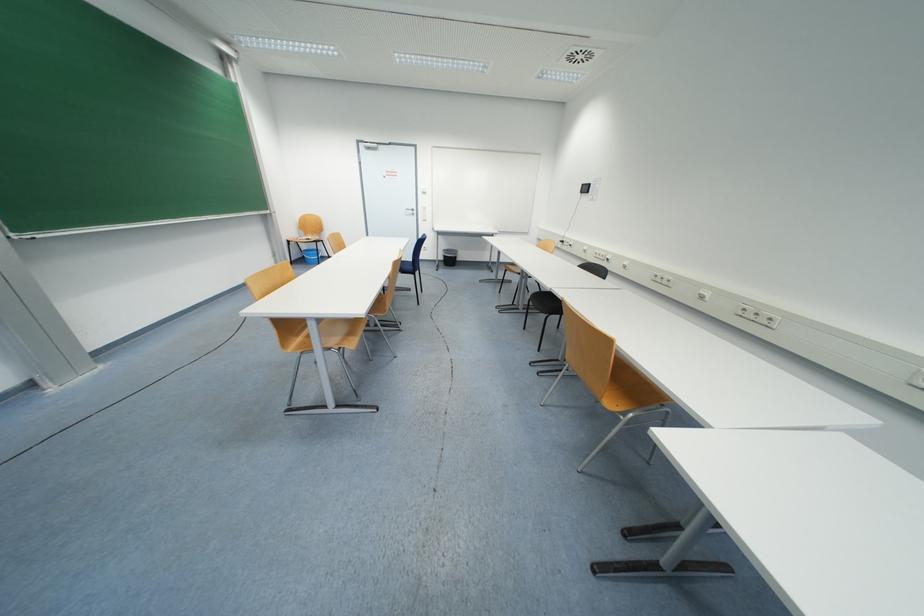
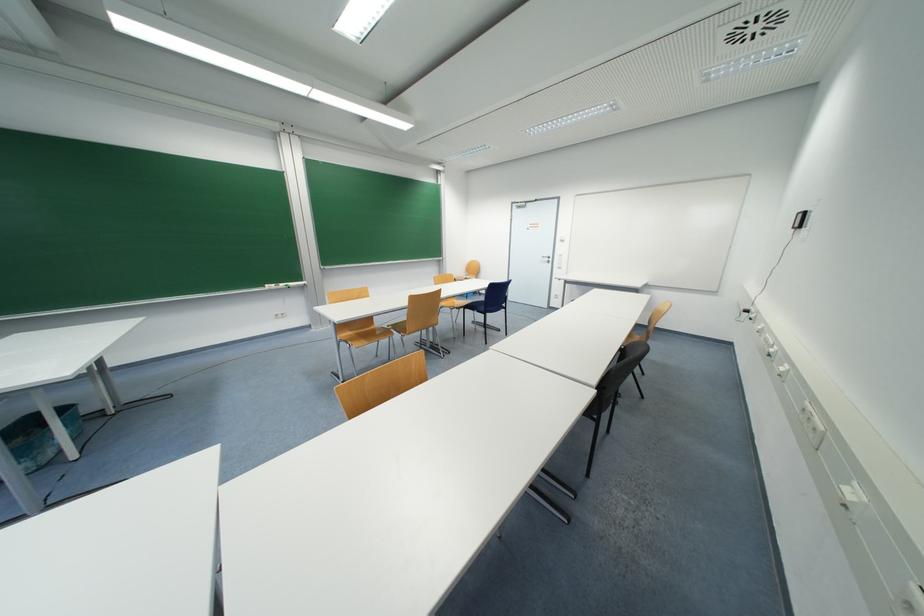
Question: I am providing you with two images of the same scene from different viewpoints. Which of the following objects are not visible in image2?

Choices:
 (A) black webcam
 (B) white board eraser
 (C) blue chair sitting surface
 (D) black trash can

Answer: (D)